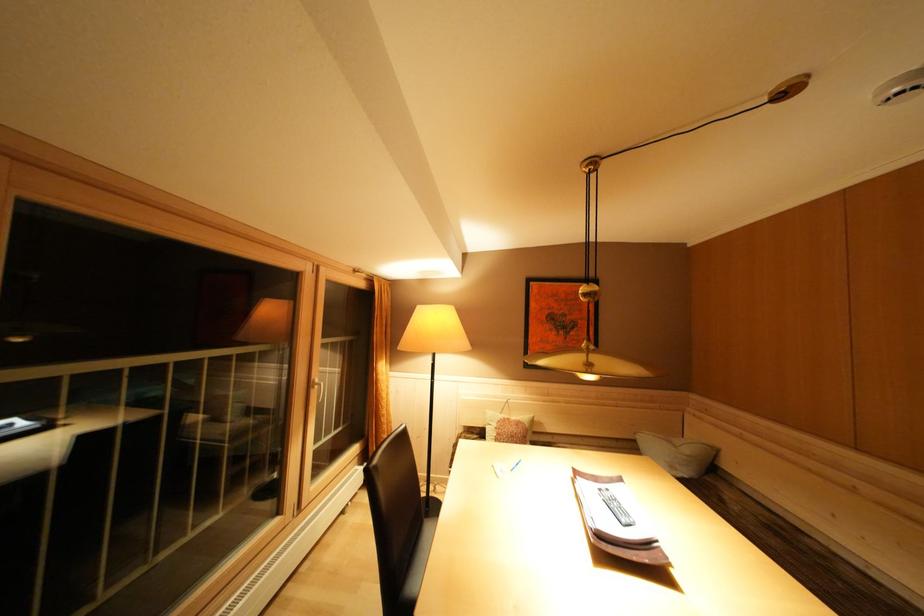
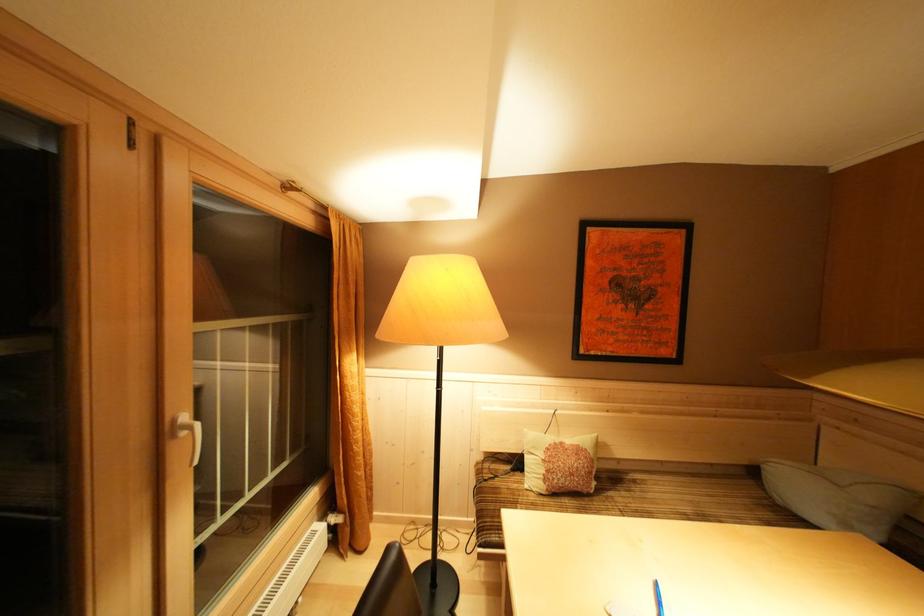
Find the pixel in the second image that matches the point at 623,445 in the first image.

(718, 468)